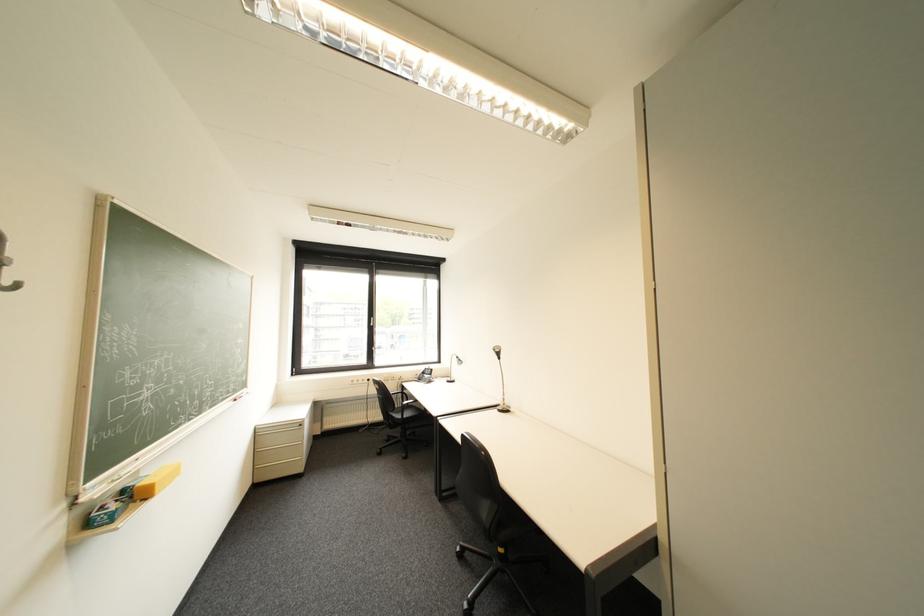
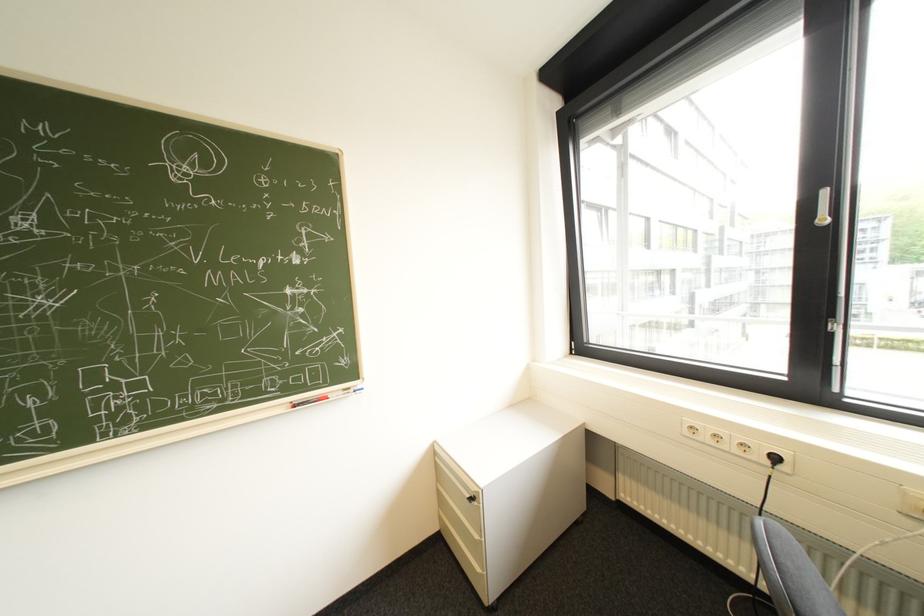
Find the pixel in the second image that matches pixel 310 426 in the first image.

(482, 499)